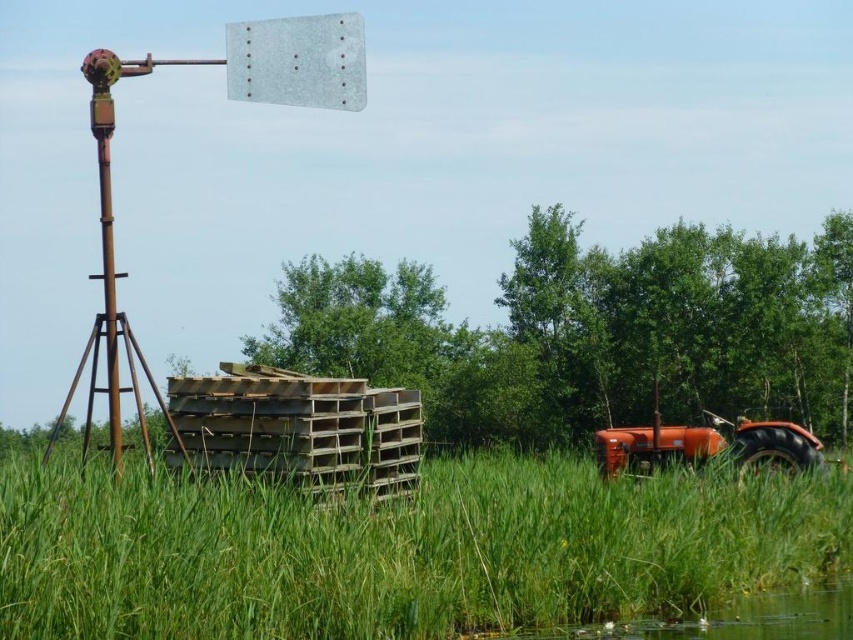
From the picture: Who is positioned more to the left, green grassy at center or orange matte tractor at lower right?

green grassy at center

Between green grassy at center and orange matte tractor at lower right, which one is positioned lower?

green grassy at center is lower down.

Locate an element on the screen. green grassy at center is located at coordinates (399, 548).